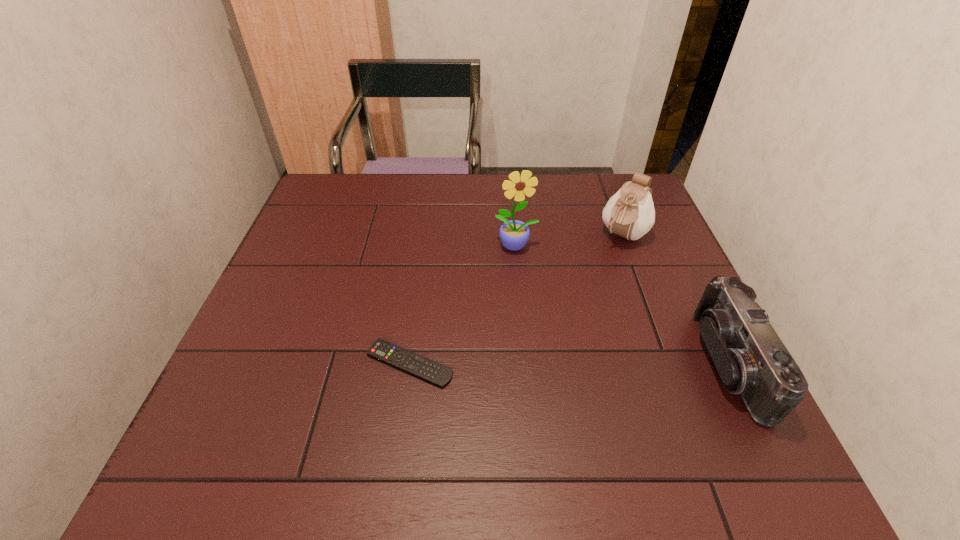
You are a GUI agent. You are given a task and a screenshot of the screen. Output one action in this format:
    pyautogui.click(x=<x>, y=<y>)
    Task: Click on the object that is the third closest one to the second object from right to left
    The height and width of the screenshot is (540, 960).
    Given the screenshot: What is the action you would take?
    pyautogui.click(x=439, y=375)

Identify the location of object identified as the closest to the leftmost object. tap(514, 234).

Image resolution: width=960 pixels, height=540 pixels. I want to click on free space that satisfies the following two spatial constraints: 1. on the front side of the pouch; 2. on the front-facing side of the camcorder, so click(x=670, y=363).

The height and width of the screenshot is (540, 960). In order to click on free space that satisfies the following two spatial constraints: 1. on the back side of the shortest object; 2. on the front-facing side of the second shortest object in this screenshot , I will do `click(410, 363)`.

The image size is (960, 540). I want to click on blank space that satisfies the following two spatial constraints: 1. on the back side of the sunflower; 2. on the right side of the pouch, so pyautogui.click(x=515, y=235).

Find the location of a particular element. vacant space that satisfies the following two spatial constraints: 1. on the front side of the pouch; 2. on the front-facing side of the rightmost object is located at coordinates (670, 363).

In order to click on free location that satisfies the following two spatial constraints: 1. on the front side of the third shortest object; 2. on the front-facing side of the camcorder in this screenshot , I will do `click(670, 363)`.

Where is `vacant region that satisfies the following two spatial constraints: 1. on the back side of the rightmost object; 2. on the front-facing side of the shortest object`? This screenshot has width=960, height=540. vacant region that satisfies the following two spatial constraints: 1. on the back side of the rightmost object; 2. on the front-facing side of the shortest object is located at coordinates (410, 363).

Identify the location of free space that satisfies the following two spatial constraints: 1. on the back side of the rightmost object; 2. on the front-facing side of the remote control. The width and height of the screenshot is (960, 540). (410, 363).